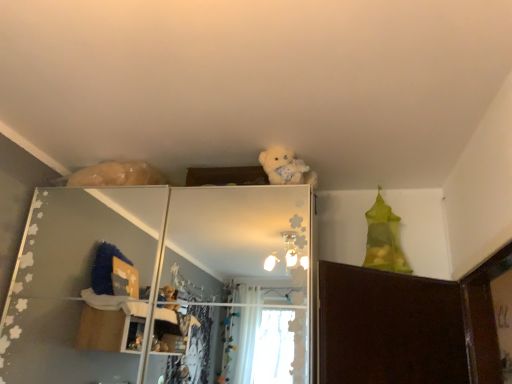
Question: From the image's perspective, is fluffy white teddy bear at upper center above or below white glossy shelf at upper center?

Choices:
 (A) below
 (B) above

Answer: (B)

Question: In terms of height, does fluffy white teddy bear at upper center look taller or shorter compared to white glossy shelf at upper center?

Choices:
 (A) short
 (B) tall

Answer: (A)

Question: Relative to white glossy shelf at upper center, is fluffy white teddy bear at upper center in front or behind?

Choices:
 (A) behind
 (B) front

Answer: (A)

Question: Considering the positions of white glossy shelf at upper center and fluffy white teddy bear at upper center in the image, is white glossy shelf at upper center wider or thinner than fluffy white teddy bear at upper center?

Choices:
 (A) thin
 (B) wide

Answer: (B)

Question: From the image's perspective, relative to fluffy white teddy bear at upper center, is white glossy shelf at upper center above or below?

Choices:
 (A) above
 (B) below

Answer: (B)

Question: Considering the positions of point (287, 370) and point (298, 162), is point (287, 370) closer or farther from the camera than point (298, 162)?

Choices:
 (A) closer
 (B) farther

Answer: (A)

Question: Visually, is white glossy shelf at upper center positioned to the left or to the right of fluffy white teddy bear at upper center?

Choices:
 (A) right
 (B) left

Answer: (B)